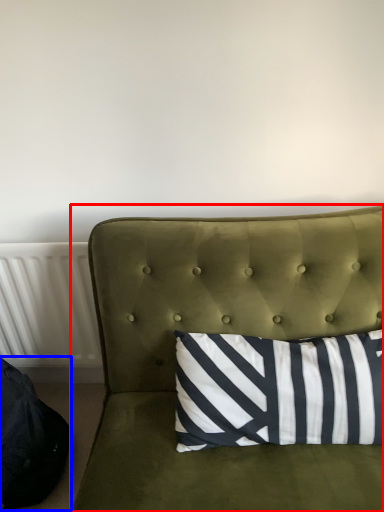
Question: Which object appears farthest to the camera in this image, studio couch (highlighted by a red box) or bean bag chair (highlighted by a blue box)?

Choices:
 (A) studio couch
 (B) bean bag chair

Answer: (B)